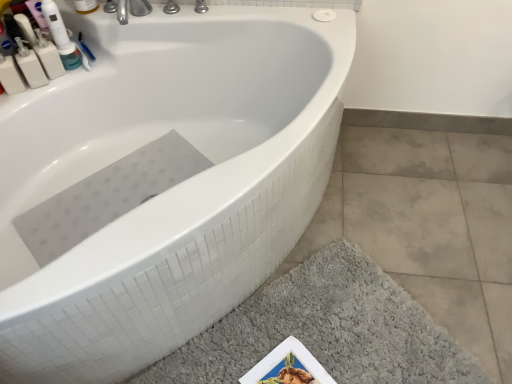
Question: Is gray shaggy bath mat at lower right a part of white plastic mouthwash at upper left, which is the 1th mouthwash from left to right?

Choices:
 (A) no
 (B) yes

Answer: (A)

Question: Is white plastic mouthwash at upper left, which is the 1th mouthwash from left to right, further to camera compared to gray shaggy bath mat at lower right?

Choices:
 (A) yes
 (B) no

Answer: (A)

Question: Is white plastic mouthwash at upper left, which is the 1th mouthwash from left to right, not within gray shaggy bath mat at lower right?

Choices:
 (A) yes
 (B) no

Answer: (A)

Question: Does white plastic mouthwash at upper left, which is the 1th mouthwash from left to right, have a lesser width compared to gray shaggy bath mat at lower right?

Choices:
 (A) no
 (B) yes

Answer: (B)

Question: Considering the relative sizes of white plastic mouthwash at upper left, which is counted as the fourth mouthwash, starting from the right, and gray shaggy bath mat at lower right in the image provided, is white plastic mouthwash at upper left, which is counted as the fourth mouthwash, starting from the right, taller than gray shaggy bath mat at lower right?

Choices:
 (A) no
 (B) yes

Answer: (B)

Question: From the image's perspective, relative to white plastic bottle at upper left, the second mouthwash from the right, is white glossy bathtub at upper center above or below?

Choices:
 (A) below
 (B) above

Answer: (A)

Question: Is white glossy bathtub at upper center to the left or to the right of white plastic bottle at upper left, the second mouthwash from the right, in the image?

Choices:
 (A) left
 (B) right

Answer: (B)

Question: From a real-world perspective, is white glossy bathtub at upper center physically located above or below white plastic bottle at upper left, the second mouthwash from the right?

Choices:
 (A) below
 (B) above

Answer: (A)

Question: Relative to white plastic bottle at upper left, which ranks as the 3th mouthwash in left-to-right order, is white glossy bathtub at upper center in front or behind?

Choices:
 (A) behind
 (B) front

Answer: (B)

Question: From the image's perspective, is white plastic mouthwash at upper left, the 2th mouthwash viewed from the left, positioned above or below white glossy bathtub at upper center?

Choices:
 (A) below
 (B) above

Answer: (B)

Question: Considering the relative positions of white plastic mouthwash at upper left, which appears as the third mouthwash when viewed from the right, and white glossy bathtub at upper center in the image provided, is white plastic mouthwash at upper left, which appears as the third mouthwash when viewed from the right, to the left or to the right of white glossy bathtub at upper center?

Choices:
 (A) right
 (B) left

Answer: (B)

Question: In the image, is white plastic mouthwash at upper left, which appears as the third mouthwash when viewed from the right, positioned in front of or behind white glossy bathtub at upper center?

Choices:
 (A) front
 (B) behind

Answer: (B)

Question: From a real-world perspective, is white plastic mouthwash at upper left, which appears as the third mouthwash when viewed from the right, physically located above or below white glossy bathtub at upper center?

Choices:
 (A) above
 (B) below

Answer: (A)

Question: Considering the positions of white plastic bottle at upper left, which ranks as the 3th mouthwash in left-to-right order, and white glossy bathtub at upper center in the image, is white plastic bottle at upper left, which ranks as the 3th mouthwash in left-to-right order, taller or shorter than white glossy bathtub at upper center?

Choices:
 (A) short
 (B) tall

Answer: (A)

Question: From a real-world perspective, is white plastic bottle at upper left, which ranks as the 3th mouthwash in left-to-right order, physically located above or below white glossy bathtub at upper center?

Choices:
 (A) above
 (B) below

Answer: (A)